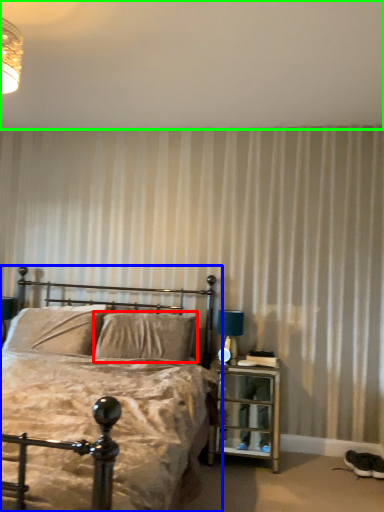
Question: Estimate the real-world distances between objects in this image. Which object is farther from pillow (highlighted by a red box), bed (highlighted by a blue box) or backdrop (highlighted by a green box)?

Choices:
 (A) bed
 (B) backdrop

Answer: (B)